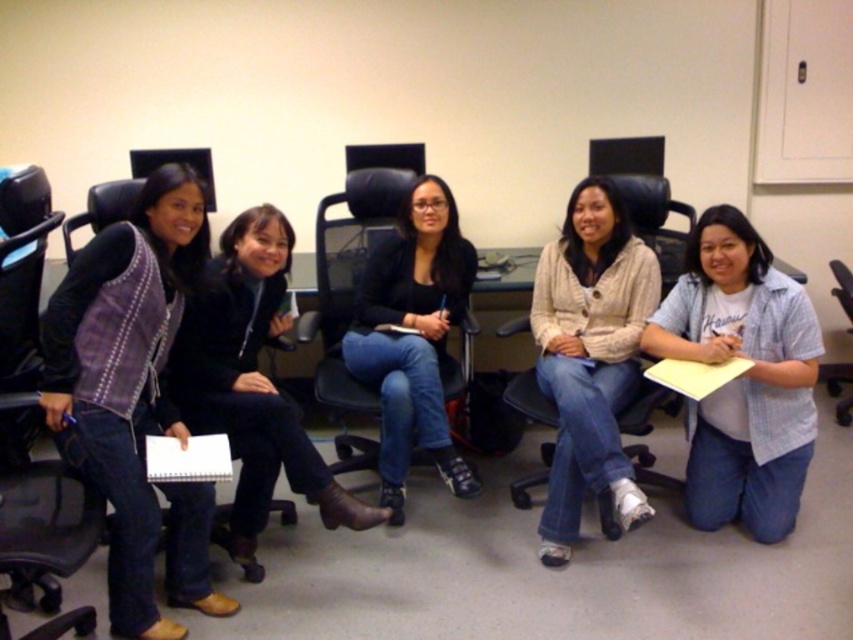
Can you confirm if black leather boots at center is positioned to the left of black plastic swivel chair at lower right?

Correct, you'll find black leather boots at center to the left of black plastic swivel chair at lower right.

Which is more to the left, black leather boots at center or black plastic swivel chair at lower right?

black leather boots at center

You are a GUI agent. You are given a task and a screenshot of the screen. Output one action in this format:
    pyautogui.click(x=<x>, y=<y>)
    Task: Click on the black leather boots at center
    Image resolution: width=853 pixels, height=640 pixels.
    Given the screenshot: What is the action you would take?
    pyautogui.click(x=251, y=380)

Which is more to the right, light blue plaid shirt at lower right or light beige sweater at center?

light blue plaid shirt at lower right

Locate an element on the screen. light blue plaid shirt at lower right is located at coordinates (741, 376).

This screenshot has width=853, height=640. Identify the location of light blue plaid shirt at lower right. click(741, 376).

Where is `light blue plaid shirt at lower right`? Image resolution: width=853 pixels, height=640 pixels. light blue plaid shirt at lower right is located at coordinates (741, 376).

Is light beige sweater at center behind black leather swivel chair at left?

Yes.

Measure the distance between light beige sweater at center and camera.

light beige sweater at center and camera are 2.28 meters apart from each other.

Is point (546, 353) more distant than point (38, 627)?

Yes, point (546, 353) is farther from viewer.

Image resolution: width=853 pixels, height=640 pixels. I want to click on light beige sweater at center, so click(590, 360).